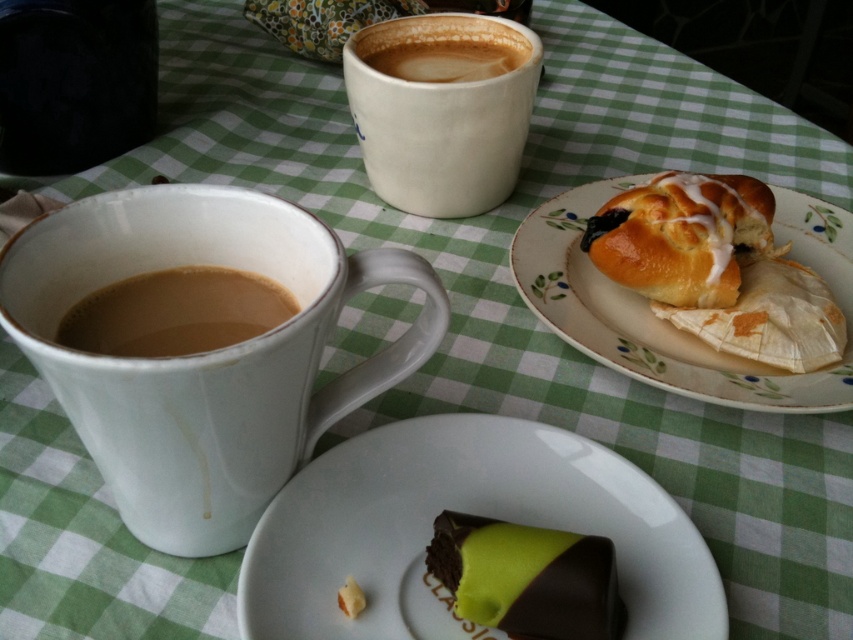
You are a barista preparing to place a new coffee cup on the table. The table has a white glossy plate at lower center and a brown matte cup at left. How far apart are these two items?

The white glossy plate at lower center is 11.48 centimeters from the brown matte cup at left.

You are a barista who needs to place a 10.5 inch diameter cake on the table. The table has a white glossy plate at lower center. Can you fit the cake on the plate?

The white glossy plate at lower center is 10.45 inches from camera. However, the distance from the camera does not indicate the plate size. The question cannot be answered with the given information.

You are a barista standing behind the counter and want to place a new coffee order on the table. The new coffee is in a 12 inch tall thermos. Can you fit the thermos between the white ceramic mug at upper center and the edge of the table without tipping anything over?

The white ceramic mug at upper center is 18.37 inches away from the viewer. Since the thermos is only 12 inches tall, it should fit between the mug and the table edge without causing any issues.